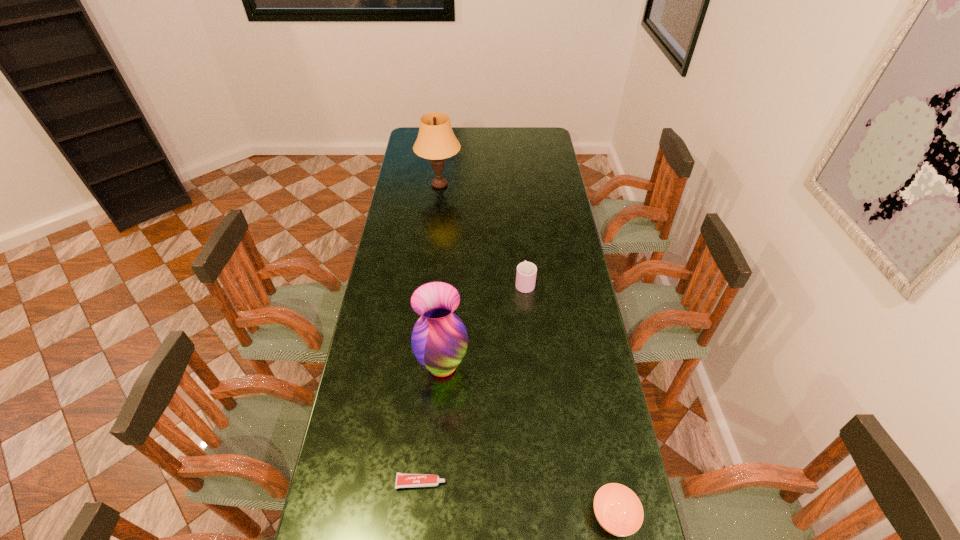
You are a GUI agent. You are given a task and a screenshot of the screen. Output one action in this format:
    pyautogui.click(x=<x>, y=<y>)
    Task: Click on the second closest object relative to the soup bowl
    This screenshot has width=960, height=540.
    Given the screenshot: What is the action you would take?
    pyautogui.click(x=439, y=340)

The width and height of the screenshot is (960, 540). Find the location of `the second closest object to the rightmost object`. the second closest object to the rightmost object is located at coordinates (439, 340).